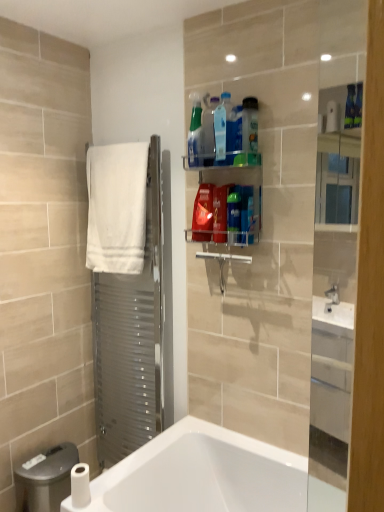
Question: In the image, is translucent plastic bottle at upper center, the first cleaning product in the right-to-left sequence, on the left side or the right side of translucent plastic spray bottle at upper center, which is the 5th cleaning product from right to left?

Choices:
 (A) left
 (B) right

Answer: (B)

Question: Is translucent plastic bottle at upper center, the first cleaning product in the right-to-left sequence, situated inside translucent plastic spray bottle at upper center, which appears as the 4th cleaning product when viewed from the left, or outside?

Choices:
 (A) outside
 (B) inside

Answer: (A)

Question: Based on their relative distances, which object is nearer to the translucent plastic spray bottle at upper center, the sixth cleaning product in the right-to-left sequence?

Choices:
 (A) translucent plastic bottles at upper center
 (B) translucent plastic spray bottle at upper center, the seventh cleaning product viewed from the left
 (C) white glossy bathtub at lower left
 (D) translucent plastic bottle at upper center, the sixth cleaning product when ordered from left to right
 (E) matte red plastic container at upper center, the 2th cleaning product in the left-to-right sequence

Answer: (A)

Question: Which is farther from the translucent plastic bottle at upper center, the 4th cleaning product positioned from the right?

Choices:
 (A) blue plastic bottle at upper center
 (B) translucent plastic spray bottle at upper center, the seventh cleaning product viewed from the left
 (C) translucent plastic bottle at upper center, the first cleaning product in the right-to-left sequence
 (D) translucent plastic spray bottle at upper center, the sixth cleaning product in the right-to-left sequence
 (E) translucent plastic spray bottle at upper center, which is the 8th cleaning product from right to left

Answer: (C)